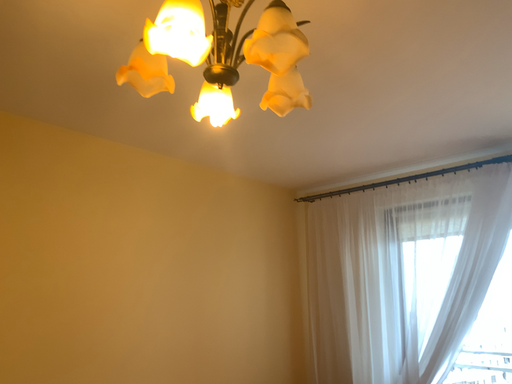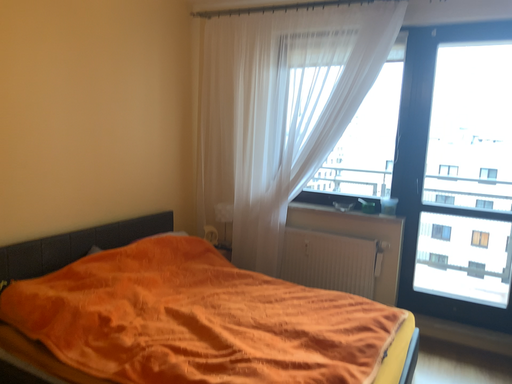
Question: Which way did the camera rotate in the video?

Choices:
 (A) rotated downward
 (B) rotated upward

Answer: (A)